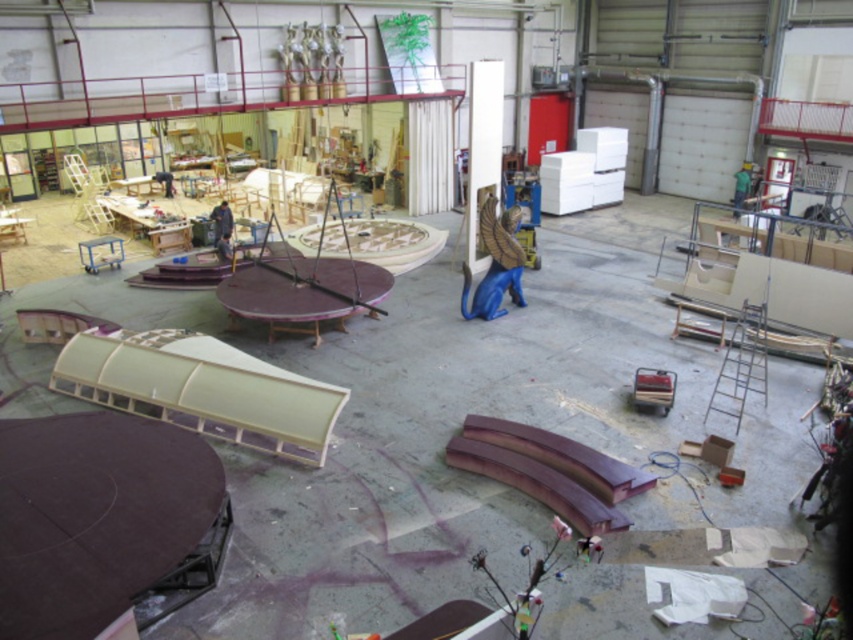
You are a delivery person who needs to place a new 10 feet long tool box between the blue matte statue at center and the blue fabric at center. Can you fit the tool box in the space between them without moving either object?

The blue matte statue at center is 21.93 feet away from the blue fabric at center. Since the tool box is only 10 feet long, there is enough space between them to place it without moving either object.

You are an observer in the workshop. You see the blue fabric at center and the green fabric person at upper right. Which object is closer to you?

The blue fabric at center is closer to you because it is in front of the green fabric person at upper right.